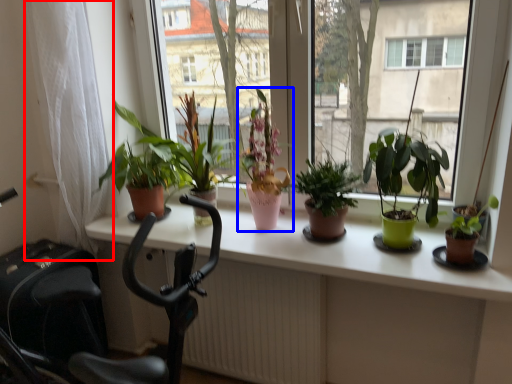
Question: Among these objects, which one is nearest to the camera, curtain (highlighted by a red box) or houseplant (highlighted by a blue box)?

Choices:
 (A) curtain
 (B) houseplant

Answer: (A)